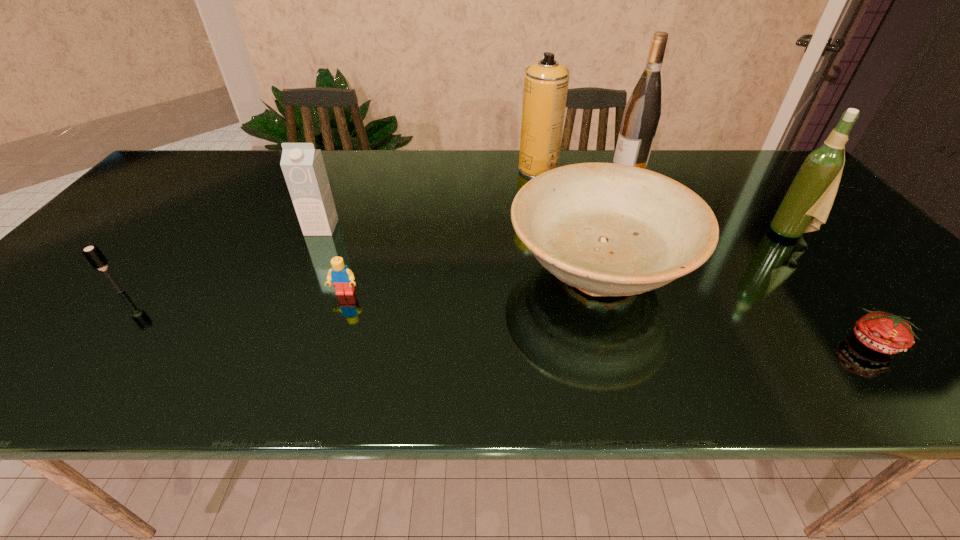
This screenshot has width=960, height=540. What are the coordinates of `the sixth object from right to left` in the screenshot? It's located at (342, 278).

You are a GUI agent. You are given a task and a screenshot of the screen. Output one action in this format:
    pyautogui.click(x=<x>, y=<y>)
    Task: Click on the Lego
    The image size is (960, 540).
    Given the screenshot: What is the action you would take?
    pyautogui.click(x=342, y=278)

You are a GUI agent. You are given a task and a screenshot of the screen. Output one action in this format:
    pyautogui.click(x=<x>, y=<y>)
    Task: Click on the shortest object
    The height and width of the screenshot is (540, 960).
    Given the screenshot: What is the action you would take?
    pyautogui.click(x=886, y=333)

Locate an element on the screen. The height and width of the screenshot is (540, 960). free location located on the front of the farther wine bottle is located at coordinates click(660, 231).

This screenshot has width=960, height=540. Find the location of `vacant space located 0.160m on the front of the aerosol can`. vacant space located 0.160m on the front of the aerosol can is located at coordinates (545, 209).

Find the location of a particular element. vacant space located 0.220m on the front-facing side of the shorter wine bottle is located at coordinates (684, 233).

Find the location of `blank space located on the front-facing side of the shorter wine bottle`. blank space located on the front-facing side of the shorter wine bottle is located at coordinates (623, 233).

Find the location of a particular element. vacant space located on the front-facing side of the shorter wine bottle is located at coordinates (711, 233).

Locate an element on the screen. The height and width of the screenshot is (540, 960). free space located 0.120m on the front label of the carton is located at coordinates (304, 267).

Find the location of a particular element. The image size is (960, 540). free space located 0.110m on the left of the fifth tallest object is located at coordinates (462, 272).